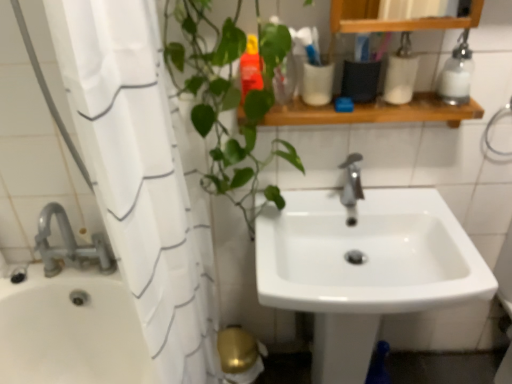
Question: Does clear glass soap dispenser at upper right appear on the left side of green leafy plant at left?

Choices:
 (A) yes
 (B) no

Answer: (B)

Question: Does clear glass soap dispenser at upper right have a smaller size compared to green leafy plant at left?

Choices:
 (A) yes
 (B) no

Answer: (A)

Question: From a real-world perspective, is clear glass soap dispenser at upper right located higher than green leafy plant at left?

Choices:
 (A) yes
 (B) no

Answer: (A)

Question: Does clear glass soap dispenser at upper right have a larger size compared to green leafy plant at left?

Choices:
 (A) yes
 (B) no

Answer: (B)

Question: Can you confirm if clear glass soap dispenser at upper right is taller than green leafy plant at left?

Choices:
 (A) no
 (B) yes

Answer: (A)

Question: Does clear glass soap dispenser at upper right appear on the right side of green leafy plant at left?

Choices:
 (A) no
 (B) yes

Answer: (B)

Question: Does wooden shelf at upper center have a greater width compared to clear glass soap dispenser at upper right?

Choices:
 (A) no
 (B) yes

Answer: (B)

Question: Is wooden shelf at upper center far away from clear glass soap dispenser at upper right?

Choices:
 (A) yes
 (B) no

Answer: (B)

Question: From a real-world perspective, is wooden shelf at upper center positioned under clear glass soap dispenser at upper right based on gravity?

Choices:
 (A) yes
 (B) no

Answer: (A)

Question: From the image's perspective, is wooden shelf at upper center below clear glass soap dispenser at upper right?

Choices:
 (A) no
 (B) yes

Answer: (B)

Question: Is wooden shelf at upper center positioned with its back to clear glass soap dispenser at upper right?

Choices:
 (A) yes
 (B) no

Answer: (B)

Question: Is wooden shelf at upper center taller than clear glass soap dispenser at upper right?

Choices:
 (A) no
 (B) yes

Answer: (A)

Question: Is white glossy container at upper right, the first toiletry viewed from the right, aimed at clear glass soap dispenser at upper right?

Choices:
 (A) yes
 (B) no

Answer: (B)